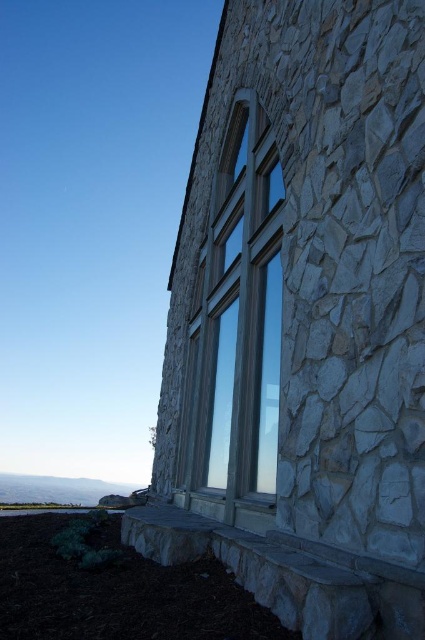
Does gray rough stone at center have a greater height compared to clear glass window at center?

Correct, gray rough stone at center is much taller as clear glass window at center.

Can you confirm if gray rough stone at center is positioned to the left of clear glass window at center?

Correct, you'll find gray rough stone at center to the left of clear glass window at center.

Is point (297, 230) closer to camera compared to point (255, 497)?

Yes, point (297, 230) is in front of point (255, 497).

The height and width of the screenshot is (640, 425). In order to click on gray rough stone at center in this screenshot , I will do `click(303, 317)`.